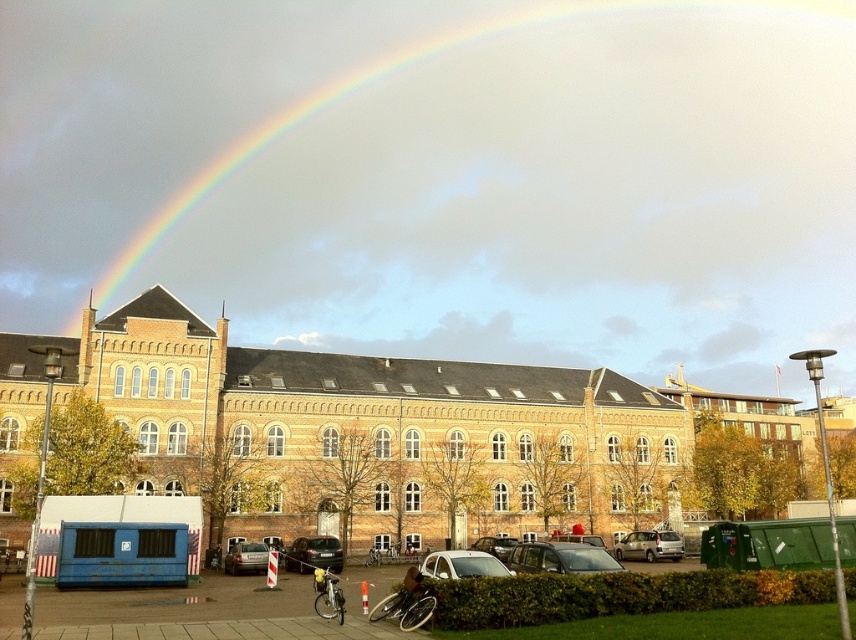
Question: Which point is closer to the camera?

Choices:
 (A) matte silver car at center
 (B) silver metallic van at center
 (C) metallic silver car at center
 (D) shiny silver car at center

Answer: (D)

Question: Which object is the closest to the rainbow at upper center?

Choices:
 (A) shiny silver car at center
 (B) shiny black car at center
 (C) metallic silver car at center

Answer: (C)

Question: Can you confirm if metallic silver car at center is positioned to the left of matte silver car at center?

Choices:
 (A) yes
 (B) no

Answer: (B)

Question: Which of the following is the closest to the observer?

Choices:
 (A) (452, 38)
 (B) (535, 561)
 (C) (482, 547)

Answer: (B)

Question: Is rainbow at upper center closer to camera compared to matte silver car at center?

Choices:
 (A) no
 (B) yes

Answer: (A)

Question: From the image, what is the correct spatial relationship of silver metallic van at center in relation to shiny black car at center?

Choices:
 (A) above
 (B) below

Answer: (B)